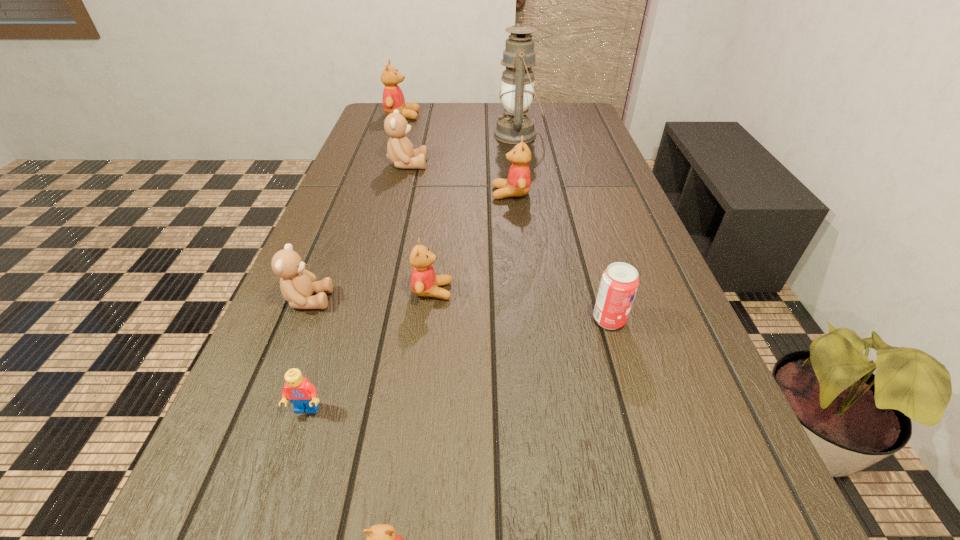
Where is `the smaller brown teddy bear`? The height and width of the screenshot is (540, 960). the smaller brown teddy bear is located at coordinates (297, 285).

Locate an element on the screen. The height and width of the screenshot is (540, 960). the rightmost object is located at coordinates (619, 282).

Locate an element on the screen. Lego is located at coordinates (302, 394).

Locate an element on the screen. The height and width of the screenshot is (540, 960). vacant region located on the left of the tallest object is located at coordinates (389, 135).

Locate an element on the screen. free spot located on the front-facing side of the farthest teddy bear is located at coordinates (496, 116).

Image resolution: width=960 pixels, height=540 pixels. I want to click on vacant area located 0.390m on the face of the bigger brown teddy bear, so click(562, 164).

Where is `vacant region located 0.100m on the front-facing side of the third nearest red teddy bear`? This screenshot has width=960, height=540. vacant region located 0.100m on the front-facing side of the third nearest red teddy bear is located at coordinates (454, 193).

You are a GUI agent. You are given a task and a screenshot of the screen. Output one action in this format:
    pyautogui.click(x=<x>, y=<y>)
    Task: Click on the free region located 0.250m on the front-facing side of the third nearest red teddy bear
    Image resolution: width=960 pixels, height=540 pixels.
    Given the screenshot: What is the action you would take?
    pyautogui.click(x=397, y=193)

This screenshot has width=960, height=540. I want to click on vacant space located on the front-facing side of the third nearest red teddy bear, so click(417, 193).

Find the location of a particular element. The width and height of the screenshot is (960, 540). vacant region located on the front-facing side of the second smallest red teddy bear is located at coordinates (482, 291).